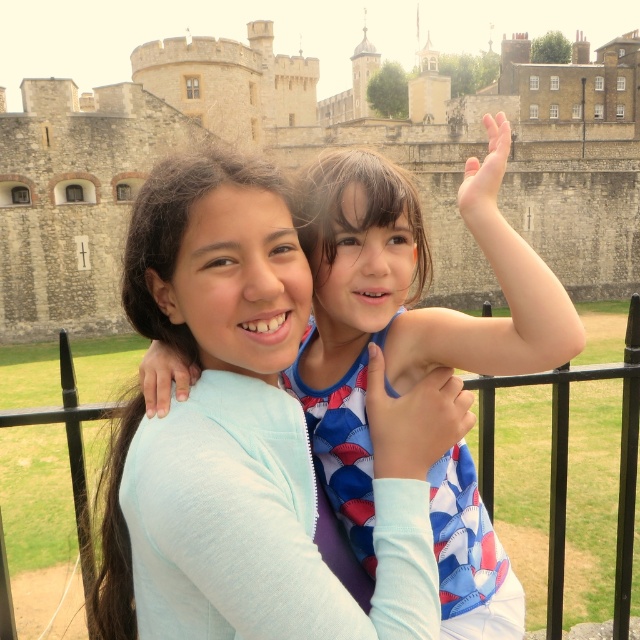
Question: Where is stone castle at center located in relation to light blue fabric shirt at center in the image?

Choices:
 (A) right
 (B) left

Answer: (B)

Question: Does stone castle at center have a larger size compared to light blue fabric shirt at center?

Choices:
 (A) yes
 (B) no

Answer: (A)

Question: Is stone castle at center smaller than light blue fabric shirt at center?

Choices:
 (A) no
 (B) yes

Answer: (A)

Question: Which of the following is the farthest from the observer?

Choices:
 (A) (172, 144)
 (B) (472, 627)

Answer: (A)